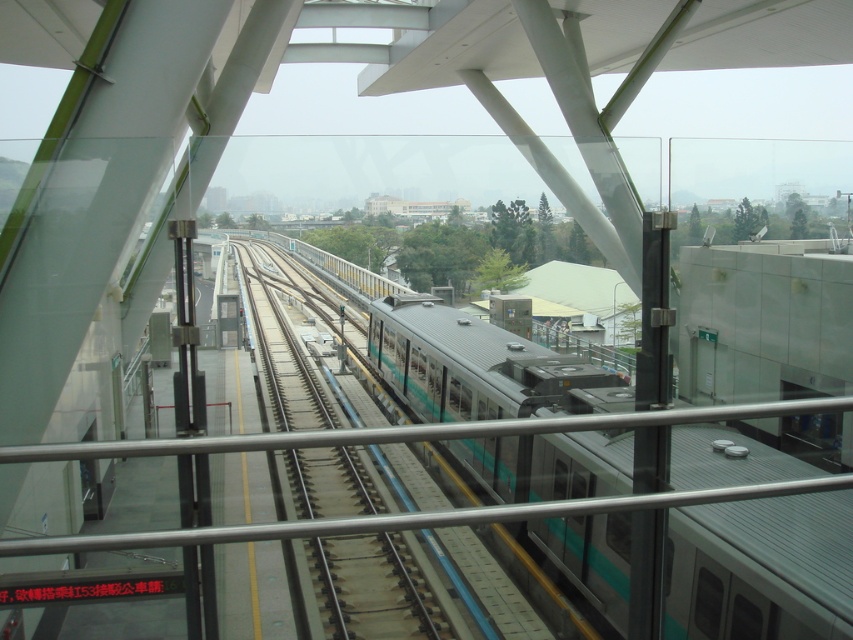
Does point (459, 323) lie in front of point (438, 614)?

No, it is behind (438, 614).

At what (x,y) coordinates should I click in order to perform the action: click on teal glossy train at center. Please return your answer as a coordinate pair (x, y). Looking at the image, I should click on (759, 568).